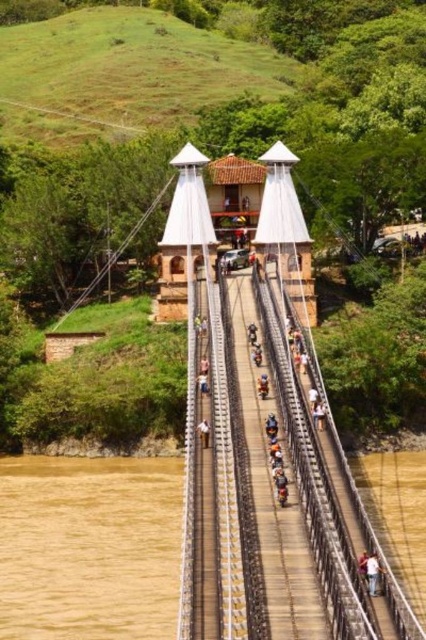
Looking at this image, you are standing at the origin point of the coordinate system. Where is the light brown wooden bridge at center located in terms of its 2D coordinates?

The light brown wooden bridge at center is located at the 2D coordinates of point [373,573].

You are standing on the suspension bridge and want to cross to the other side. There is brown muddy water at lower left. Where is the brown muddy water located relative to your position?

The brown muddy water at lower left is located at point (89, 547), which means it is positioned to the lower left of your current position on the bridge.

You are standing on the suspension bridge and want to take a photo of two specific points. The first point is at coordinates point (x=178, y=592) and the second point is at point (x=373, y=554). Which point is closer to your camera when you aim to capture both in the frame?

Point (x=373, y=554) is closer to the camera than point (x=178, y=592) because the latter is further away from the camera.